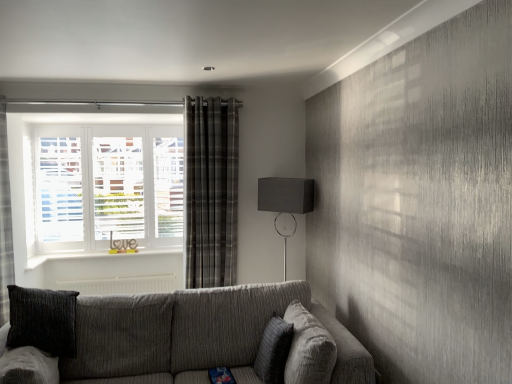
Question: Could you tell me if metallic curtain rod at upper center is turned towards plaid fabric curtain at center?

Choices:
 (A) yes
 (B) no

Answer: (B)

Question: Is the depth of metallic curtain rod at upper center greater than that of plaid fabric curtain at center?

Choices:
 (A) no
 (B) yes

Answer: (A)

Question: Does metallic curtain rod at upper center have a larger size compared to plaid fabric curtain at center?

Choices:
 (A) yes
 (B) no

Answer: (B)

Question: Can we say metallic curtain rod at upper center lies outside plaid fabric curtain at center?

Choices:
 (A) yes
 (B) no

Answer: (A)

Question: Is metallic curtain rod at upper center surrounding plaid fabric curtain at center?

Choices:
 (A) no
 (B) yes

Answer: (A)

Question: Considering the relative sizes of metallic curtain rod at upper center and plaid fabric curtain at center in the image provided, is metallic curtain rod at upper center shorter than plaid fabric curtain at center?

Choices:
 (A) no
 (B) yes

Answer: (B)

Question: Is metallic curtain rod at upper center further to camera compared to textured gray couch at lower center?

Choices:
 (A) no
 (B) yes

Answer: (B)

Question: From the image's perspective, is metallic curtain rod at upper center on top of textured gray couch at lower center?

Choices:
 (A) yes
 (B) no

Answer: (A)

Question: Is textured gray couch at lower center a part of metallic curtain rod at upper center?

Choices:
 (A) no
 (B) yes

Answer: (A)

Question: Considering the relative positions of metallic curtain rod at upper center and textured gray couch at lower center in the image provided, is metallic curtain rod at upper center to the right of textured gray couch at lower center from the viewer's perspective?

Choices:
 (A) yes
 (B) no

Answer: (B)

Question: Is metallic curtain rod at upper center at the left side of textured gray couch at lower center?

Choices:
 (A) yes
 (B) no

Answer: (A)

Question: Is metallic curtain rod at upper center far away from textured gray couch at lower center?

Choices:
 (A) no
 (B) yes

Answer: (B)

Question: Is textured gray pillow at center at the back of textured gray couch at lower center?

Choices:
 (A) yes
 (B) no

Answer: (A)